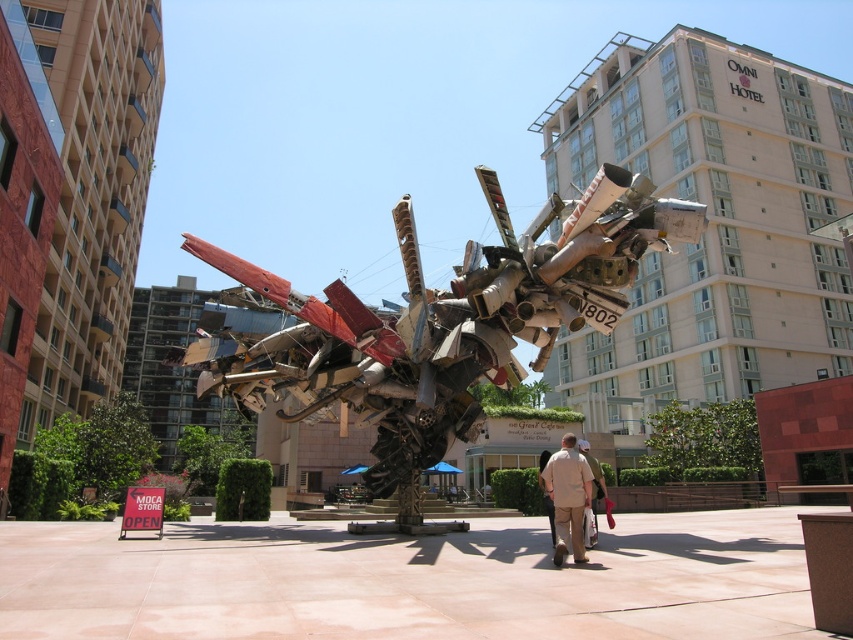
Between point (567, 467) and point (589, 529), which one is positioned in front?

Point (567, 467) is more forward.

Can you confirm if tan fabric shirt at center is wider than beige fabric pants at center?

No, tan fabric shirt at center is not wider than beige fabric pants at center.

Does point (566, 436) come in front of point (593, 532)?

That is True.

Image resolution: width=853 pixels, height=640 pixels. What are the coordinates of `tan fabric shirt at center` in the screenshot? It's located at (567, 497).